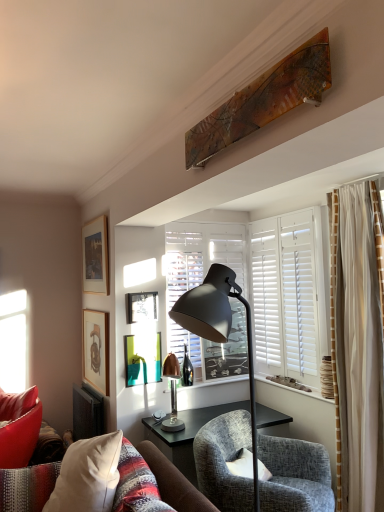
Question: Is velvet white pillow at lower left inside the boundaries of teal glossy picture frame at center, which is counted as the second picture frame, starting from the bottom, or outside?

Choices:
 (A) outside
 (B) inside

Answer: (A)

Question: Is velvet white pillow at lower left wider or thinner than teal glossy picture frame at center, which is counted as the second picture frame, starting from the bottom?

Choices:
 (A) wide
 (B) thin

Answer: (A)

Question: Estimate the real-world distances between objects in this image. Which object is farther from the matte black lamp at center, arranged as the 2th lamp when viewed from the back?

Choices:
 (A) copper metallic lamp at center, which ranks as the first lamp in back-to-front order
 (B) textured gray armchair at center
 (C) white matte window at center
 (D) velvet white pillow at lower left
 (E) wooden picture frame at upper left, placed as the fourth picture frame when sorted from bottom to top

Answer: (C)

Question: Considering the real-world distances, which object is closest to the wooden matte picture frame at upper left, positioned as the fourth picture frame in top-to-bottom order?

Choices:
 (A) wooden picture frame at upper left, placed as the fourth picture frame when sorted from bottom to top
 (B) matte black lamp at center, arranged as the 2th lamp when viewed from the back
 (C) copper metallic lamp at center, which ranks as the first lamp in back-to-front order
 (D) textured gray armchair at center
 (E) white matte window at center

Answer: (A)